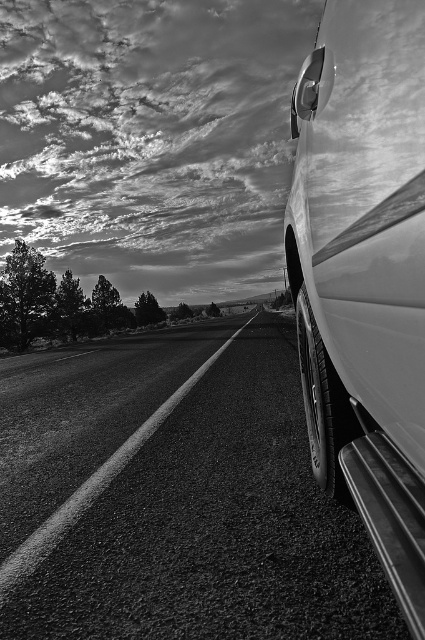
Question: Does asphalt road at center appear over glossy white car at right?

Choices:
 (A) no
 (B) yes

Answer: (A)

Question: Based on their relative distances, which object is nearer to the asphalt road at center?

Choices:
 (A) glossy white car at right
 (B) glossy white car door at lower right

Answer: (B)

Question: Which point appears farthest from the camera in this image?

Choices:
 (A) (391, 296)
 (B) (306, 627)

Answer: (B)

Question: Is glossy white car at right further to camera compared to glossy white car door at lower right?

Choices:
 (A) no
 (B) yes

Answer: (B)

Question: Does asphalt road at center have a greater width compared to glossy white car door at lower right?

Choices:
 (A) no
 (B) yes

Answer: (B)

Question: Estimate the real-world distances between objects in this image. Which object is farther from the glossy white car at right?

Choices:
 (A) glossy white car door at lower right
 (B) asphalt road at center

Answer: (B)